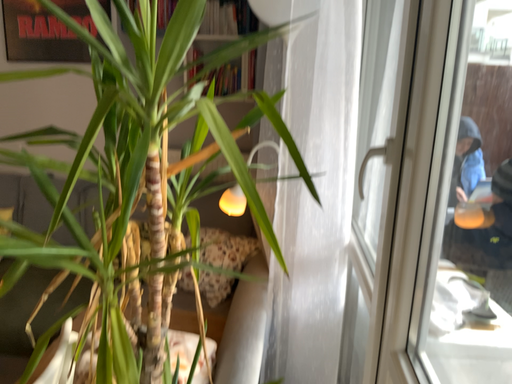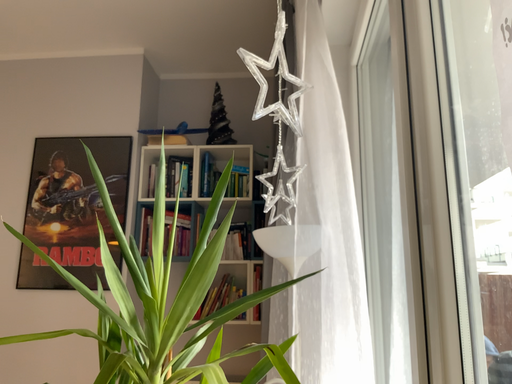
Question: How did the camera likely rotate when shooting the video?

Choices:
 (A) rotated downward
 (B) rotated upward

Answer: (B)